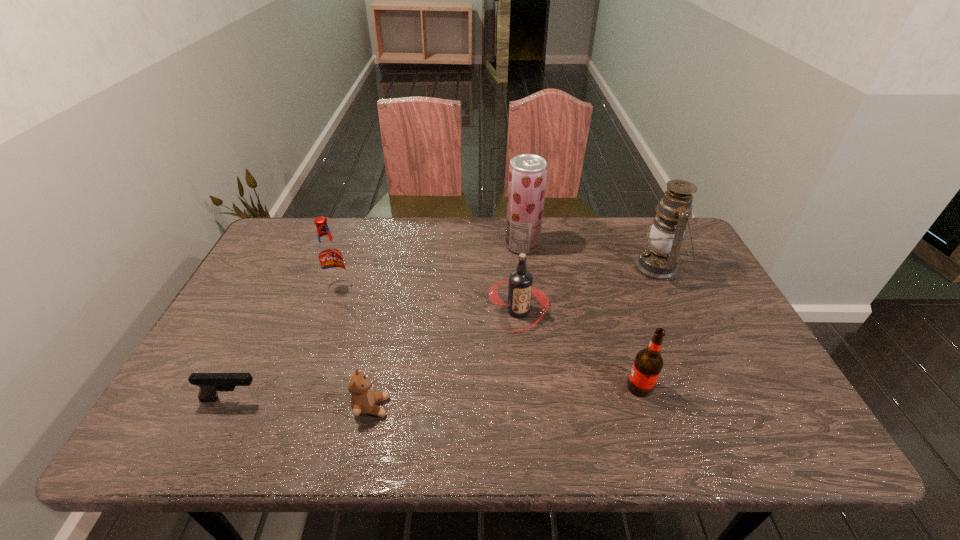
At what (x,y) coordinates should I click in order to perform the action: click on object positioned at the near edge. Please return your answer as a coordinate pair (x, y). Looking at the image, I should click on (363, 399).

Where is `object at the left edge`? This screenshot has width=960, height=540. object at the left edge is located at coordinates (209, 383).

The height and width of the screenshot is (540, 960). In order to click on object present at the right edge in this screenshot , I will do `click(659, 261)`.

The height and width of the screenshot is (540, 960). What are the coordinates of `object at the far right corner` in the screenshot? It's located at tap(659, 261).

The image size is (960, 540). Identify the location of free spot at the far edge of the desktop. (413, 238).

This screenshot has height=540, width=960. What are the coordinates of `vacant space at the near edge of the desktop` in the screenshot? It's located at (531, 451).

The width and height of the screenshot is (960, 540). I want to click on free space at the right edge of the desktop, so click(779, 410).

In the image, there is a desktop. Where is `free space at the far left corner`? The width and height of the screenshot is (960, 540). free space at the far left corner is located at coordinates (298, 244).

Identify the location of free space at the near right corner of the desktop. This screenshot has width=960, height=540. (724, 416).

Identify the location of vacant space in between the second root beer from right to left and the leftmost object. (375, 355).